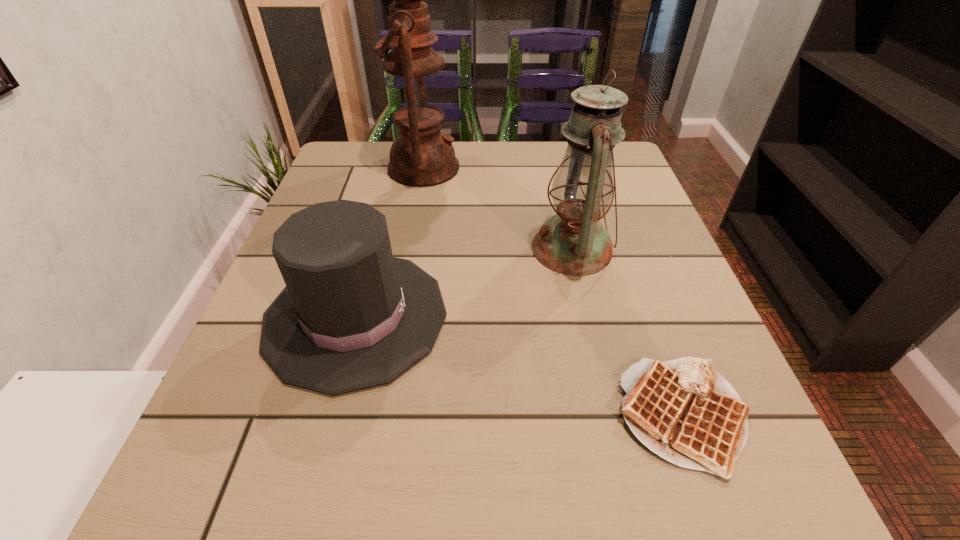
You are a GUI agent. You are given a task and a screenshot of the screen. Output one action in this format:
    pyautogui.click(x=<x>, y=<y>)
    Task: Click on the free space between the left oil lamp and the nearer oil lamp
    
    Given the screenshot: What is the action you would take?
    pyautogui.click(x=497, y=208)

The height and width of the screenshot is (540, 960). In order to click on free point between the waffle and the right oil lamp in this screenshot , I will do [627, 332].

Image resolution: width=960 pixels, height=540 pixels. In order to click on free spot between the shortest object and the third tallest object in this screenshot , I will do `click(519, 367)`.

Locate which object ranks second in proximity to the right oil lamp. Please provide its 2D coordinates. Your answer should be formatted as a tuple, i.e. [(x, y)], where the tuple contains the x and y coordinates of a point satisfying the conditions above.

[(683, 410)]

At what (x,y) coordinates should I click in order to perform the action: click on the second closest object relative to the dress hat. Please return your answer as a coordinate pair (x, y). Image resolution: width=960 pixels, height=540 pixels. Looking at the image, I should click on (421, 156).

At what (x,y) coordinates should I click in order to perform the action: click on free space that satisfies the following two spatial constraints: 1. on the front of the shortest object with the decoration; 2. on the right side of the dress hat. Please return your answer as a coordinate pair (x, y). The image size is (960, 540). Looking at the image, I should click on (329, 416).

This screenshot has height=540, width=960. I want to click on free space in the image that satisfies the following two spatial constraints: 1. on the front of the dress hat with the decoration; 2. on the right side of the shortest object, so click(329, 416).

Find the location of a particular element. The width and height of the screenshot is (960, 540). vacant space that satisfies the following two spatial constraints: 1. on the front side of the right oil lamp; 2. on the left side of the farthest object is located at coordinates (409, 248).